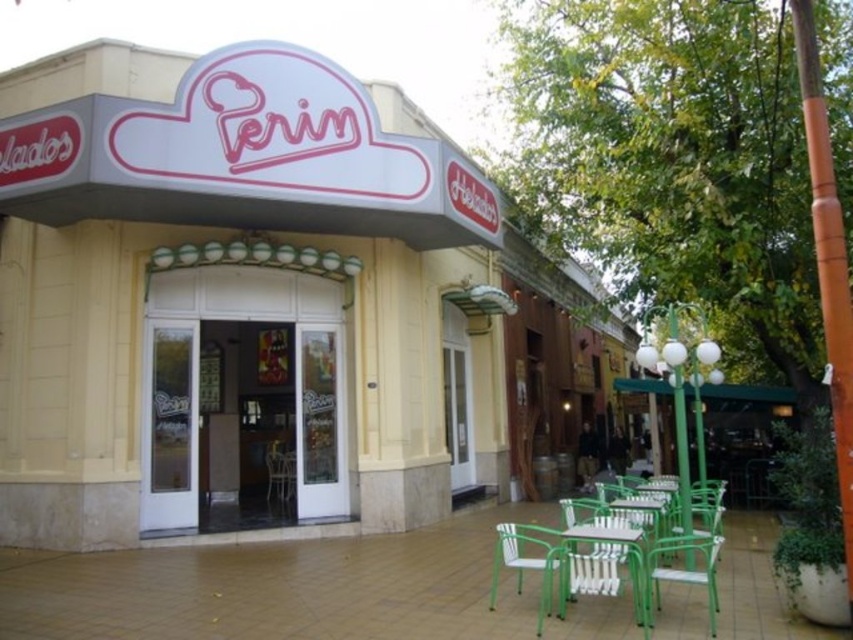
From the picture: Which of these two, green metal chair at lower right or green plastic chair at lower right, stands taller?

green metal chair at lower right

Can you confirm if green metal chair at lower right is shorter than green plastic chair at lower right?

In fact, green metal chair at lower right may be taller than green plastic chair at lower right.

You are a GUI agent. You are given a task and a screenshot of the screen. Output one action in this format:
    pyautogui.click(x=<x>, y=<y>)
    Task: Click on the green metal chair at lower right
    This screenshot has height=640, width=853.
    Given the screenshot: What is the action you would take?
    pyautogui.click(x=601, y=561)

I want to click on green metal chair at lower right, so click(x=601, y=561).

Who is more forward, (636, 618) or (271, 490)?

Positioned in front is point (636, 618).

In the scene shown: Does green metal chair at lower right have a smaller size compared to white plastic chair at center?

Actually, green metal chair at lower right might be larger than white plastic chair at center.

Does point (647, 554) come farther from viewer compared to point (271, 465)?

No, (647, 554) is closer to viewer.

Identify the location of green metal chair at lower right. (601, 561).

Between green plastic chair at lower right and white plastic chair at center, which one has more height?

green plastic chair at lower right

Locate an element on the screen. green plastic chair at lower right is located at coordinates (683, 568).

This screenshot has height=640, width=853. Find the location of `green plastic chair at lower right`. green plastic chair at lower right is located at coordinates (683, 568).